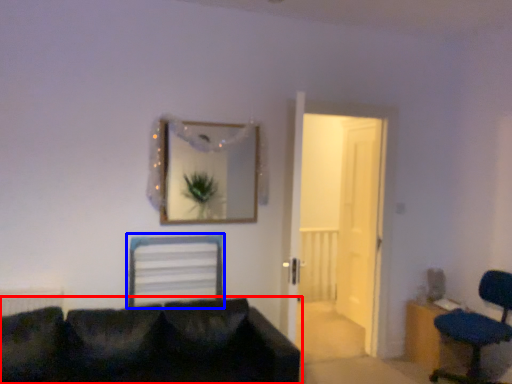
Question: Which object appears closest to the camera in this image, studio couch (highlighted by a red box) or computer chair (highlighted by a blue box)?

Choices:
 (A) studio couch
 (B) computer chair

Answer: (A)